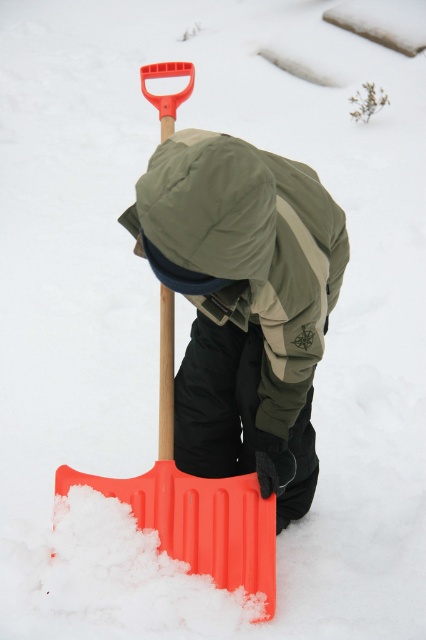
Question: Is green matte jacket at center wider than orange plastic shovel at center?

Choices:
 (A) yes
 (B) no

Answer: (B)

Question: Is green matte jacket at center to the right of orange plastic shovel at center from the viewer's perspective?

Choices:
 (A) yes
 (B) no

Answer: (A)

Question: Which point is closer to the camera?

Choices:
 (A) green matte jacket at center
 (B) orange plastic shovel at center

Answer: (A)

Question: Is green matte jacket at center below orange plastic shovel at center?

Choices:
 (A) no
 (B) yes

Answer: (A)